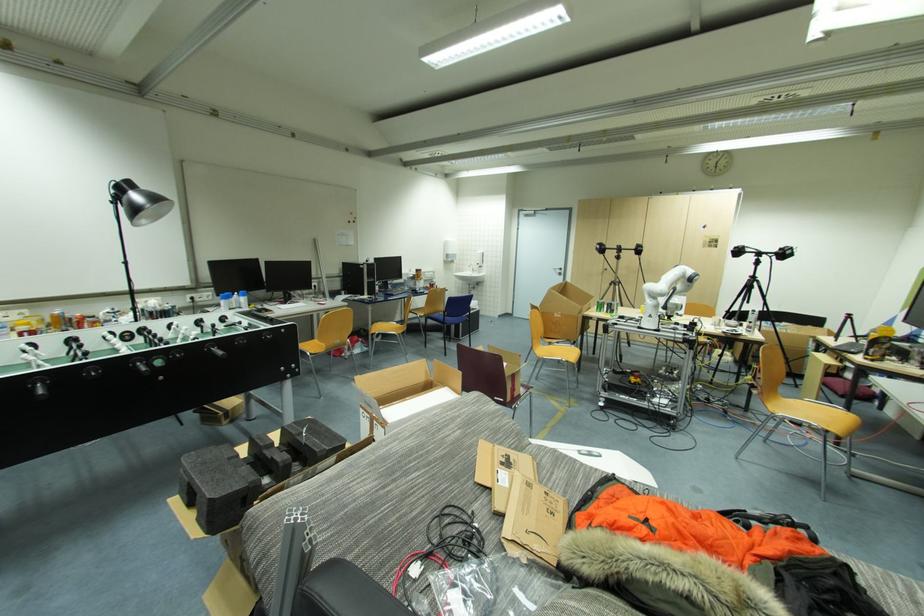
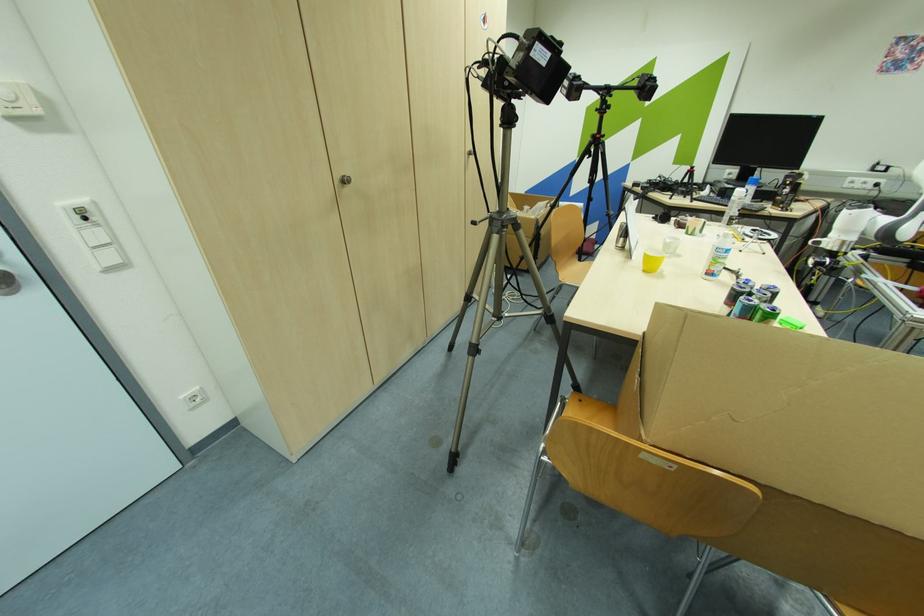
Locate, in the second image, the point that corresponds to [609,270] in the first image.

(348, 182)